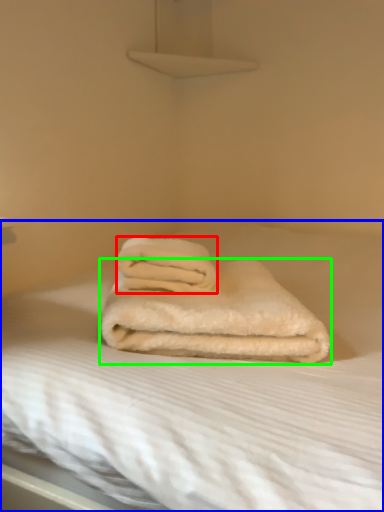
Question: Based on their relative distances, which object is nearer to towel (highlighted by a red box)? Choose from bed (highlighted by a blue box) and towel (highlighted by a green box).

Choices:
 (A) bed
 (B) towel

Answer: (B)